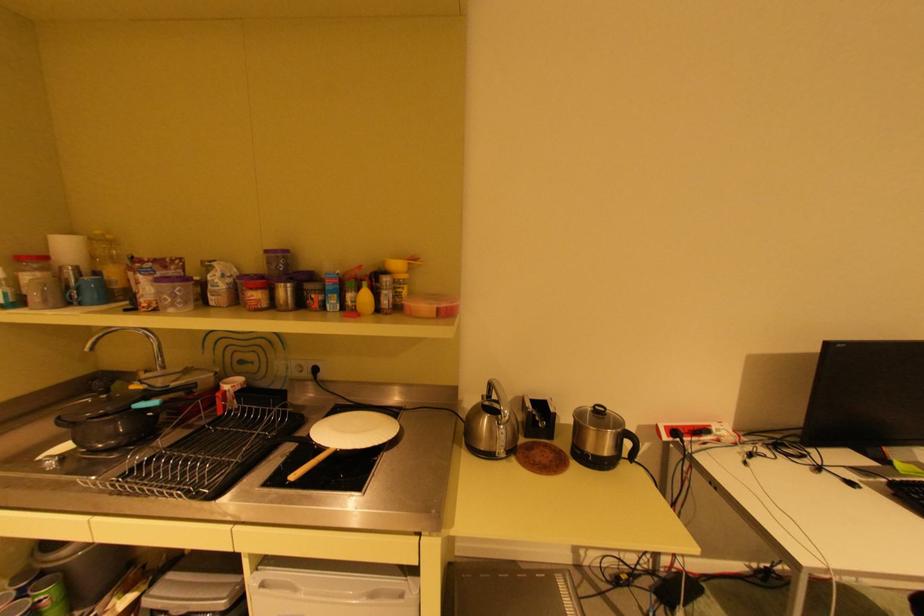
Image resolution: width=924 pixels, height=616 pixels. What do you see at coordinates (191, 594) in the screenshot? I see `the grey bin lid` at bounding box center [191, 594].